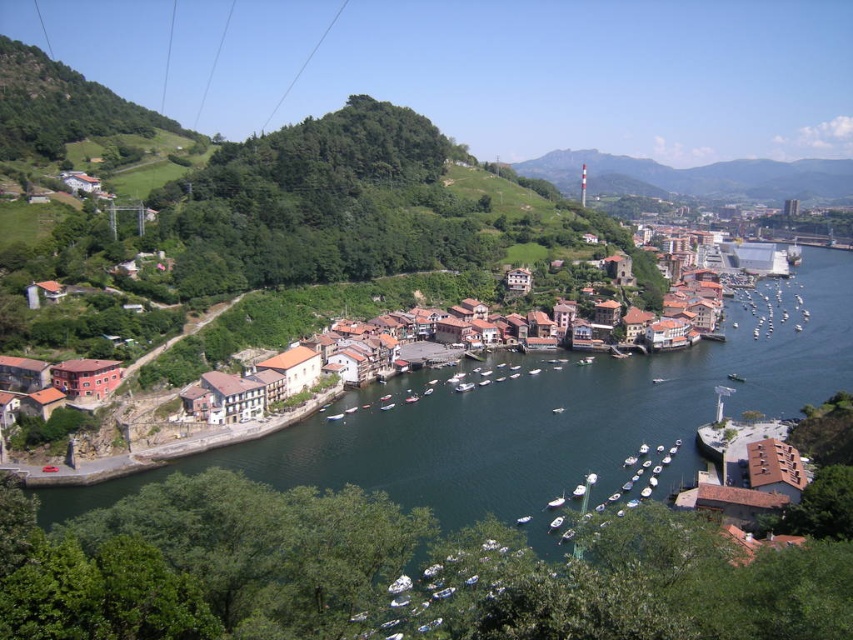
You are standing at the edge of the green grassy hillside at upper center and want to walk to the dark blue water at center. Which direction should you head to reach the water?

Since the dark blue water at center has a lesser width compared to the green grassy hillside at upper center, you should head downward towards the center to reach the dark blue water at center.

You are standing at the point marked by coordinates point (x=548, y=417) in the image. What do you see around you?

You are standing in dark blue water at center as marked by point (x=548, y=417).